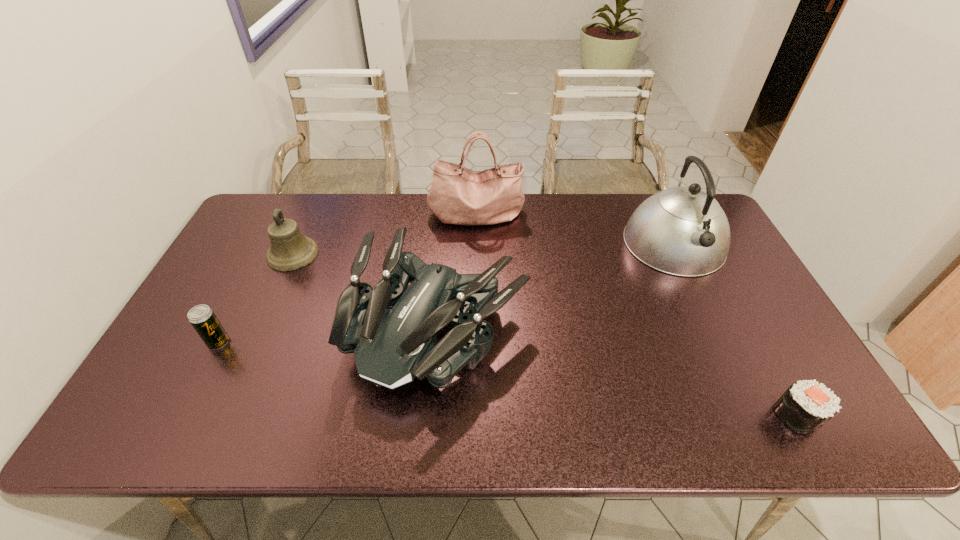
Identify the location of vacant region located on the back of the beer can. (265, 252).

This screenshot has height=540, width=960. In order to click on vacant space located 0.310m on the left of the sushi in this screenshot , I will do `click(636, 416)`.

Find the location of a particular element. handbag located in the far edge section of the desktop is located at coordinates (458, 195).

Where is `kettle that is positioned at the far edge`? kettle that is positioned at the far edge is located at coordinates (683, 231).

Locate an element on the screen. Image resolution: width=960 pixels, height=540 pixels. drone at the near edge is located at coordinates (392, 330).

At what (x,y) coordinates should I click in order to perform the action: click on sushi that is at the near edge. Please return your answer as a coordinate pair (x, y). Looking at the image, I should click on (806, 405).

Where is `bell that is at the left edge`? bell that is at the left edge is located at coordinates (290, 250).

Identify the location of beer can positioned at the left edge. The image size is (960, 540). (202, 317).

What are the coordinates of `kettle that is at the right edge` in the screenshot? It's located at (683, 231).

Locate an element on the screen. sushi at the right edge is located at coordinates (806, 405).